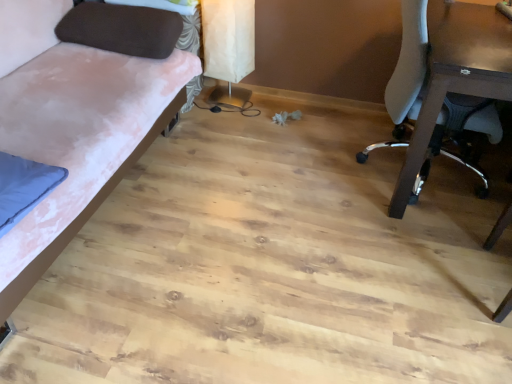
Question: Is velvet pink fabric couch at left spatially inside brown fabric pillow at upper left, or outside of it?

Choices:
 (A) inside
 (B) outside

Answer: (B)

Question: In the image, is velvet pink fabric couch at left positioned in front of or behind brown fabric pillow at upper left?

Choices:
 (A) behind
 (B) front

Answer: (B)

Question: Which object is the closest to the velvet pink fabric couch at left?

Choices:
 (A) white mesh chair at right
 (B) brown fabric pillow at upper left
 (C) white paper lampshade at upper center

Answer: (B)

Question: Which object is the closest to the brown fabric pillow at upper left?

Choices:
 (A) white mesh chair at right
 (B) white paper lampshade at upper center
 (C) velvet pink fabric couch at left

Answer: (C)